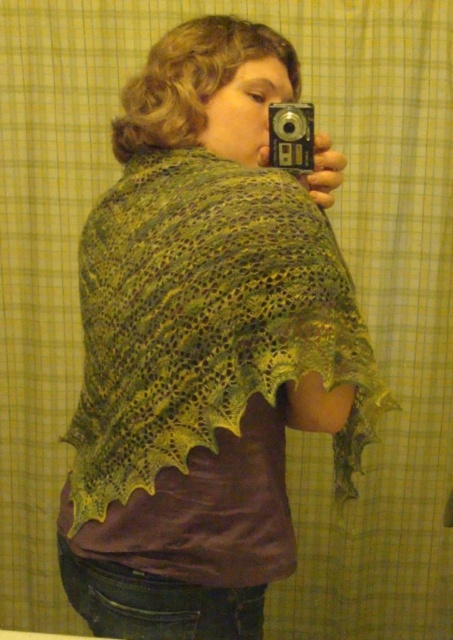
You are a photographer analyzing the composition of this selfie. The green lace shawl at upper center and the silver metallic camera at upper center are both in the frame. Which object is closer to the camera lens?

The silver metallic camera at upper center is closer to the camera lens because the green lace shawl at upper center is positioned under it, indicating it is behind the camera in the frame.

You are trying to frame a photo of the person in the mirror. The green lace shawl at upper center is partially blocking the view. Can you move the camera slightly to the right so that the point at coordinates point (206, 346) is no longer in the frame?

The point (206, 346) indicates the green lace shawl at upper center. Moving the camera to the right would shift the frame, potentially removing the green lace shawl at upper center from the view. However, without knowing the exact camera movement range or frame boundaries, it is uncertain if this adjustment will fully exclude the shawl. Consider experimenting with small movements to test visibility.

You are a photographer analyzing the composition of the selfie. You need to determine which object is positioned higher in the frame between the green lace shawl at upper center and the silver metallic camera at upper center. Based on the scene, which one is higher?

The green lace shawl at upper center is taller than the silver metallic camera at upper center, so the green lace shawl at upper center is positioned higher in the frame.